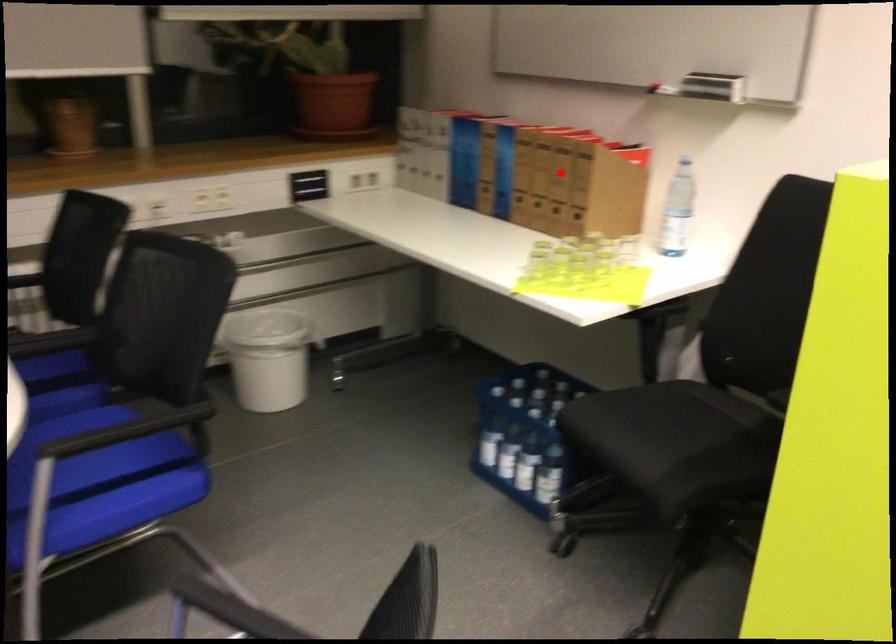
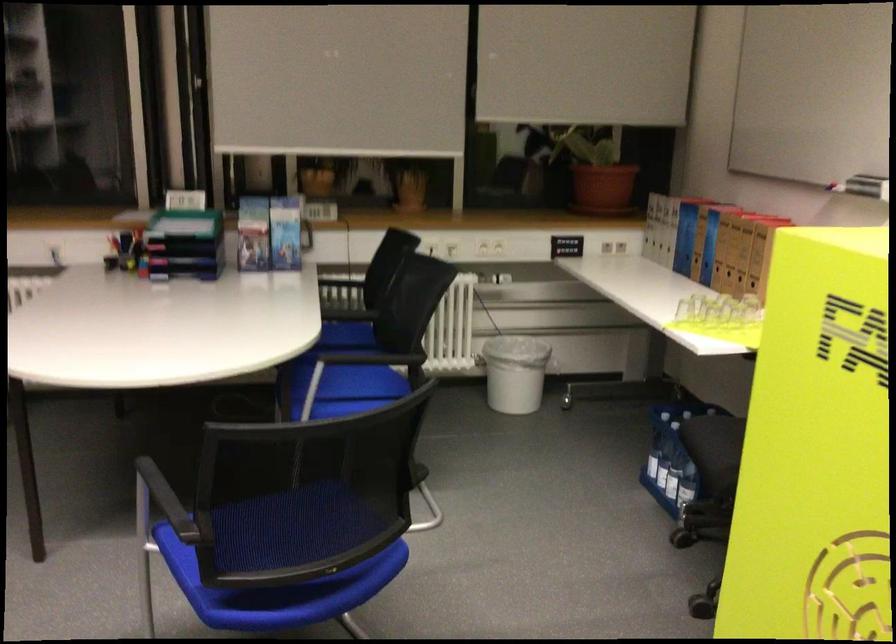
Find the pixel in the second image that matches the highlighted location in the first image.

(746, 243)